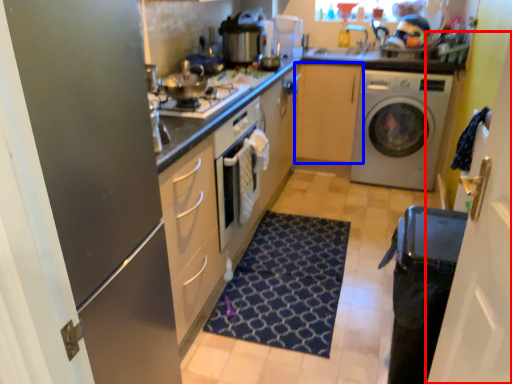
Question: Among these objects, which one is farthest to the camera, glass door (highlighted by a red box) or cabinetry (highlighted by a blue box)?

Choices:
 (A) glass door
 (B) cabinetry

Answer: (B)